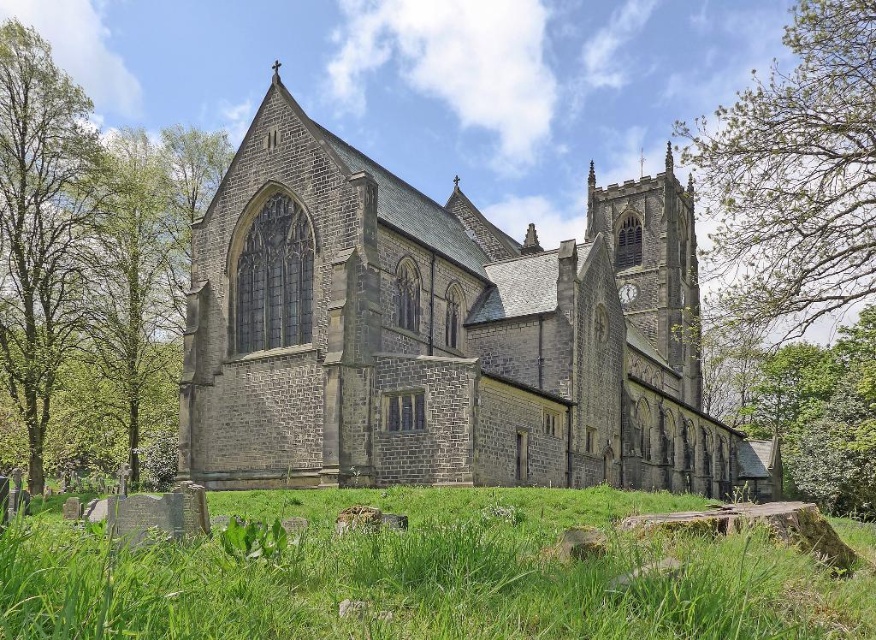
Question: Which point is farther from the camera taking this photo?

Choices:
 (A) (25, 305)
 (B) (698, 147)
 (C) (481, 524)
 (D) (486, 468)

Answer: (A)

Question: Estimate the real-world distances between objects in this image. Which object is closer to the green grass at lower center?

Choices:
 (A) green leafy tree at left
 (B) green leafy branches at upper right
 (C) gray stone church at center

Answer: (C)

Question: Is green grass at lower center to the left of green leafy branches at upper right from the viewer's perspective?

Choices:
 (A) yes
 (B) no

Answer: (A)

Question: Which object is farther from the camera taking this photo?

Choices:
 (A) gray stone church at center
 (B) green leafy branches at upper right
 (C) green leafy tree at left
 (D) green grass at lower center

Answer: (C)

Question: Can you confirm if gray stone church at center is positioned above green leafy tree at left?

Choices:
 (A) no
 (B) yes

Answer: (A)

Question: Does green grass at lower center appear under green leafy tree at left?

Choices:
 (A) no
 (B) yes

Answer: (B)